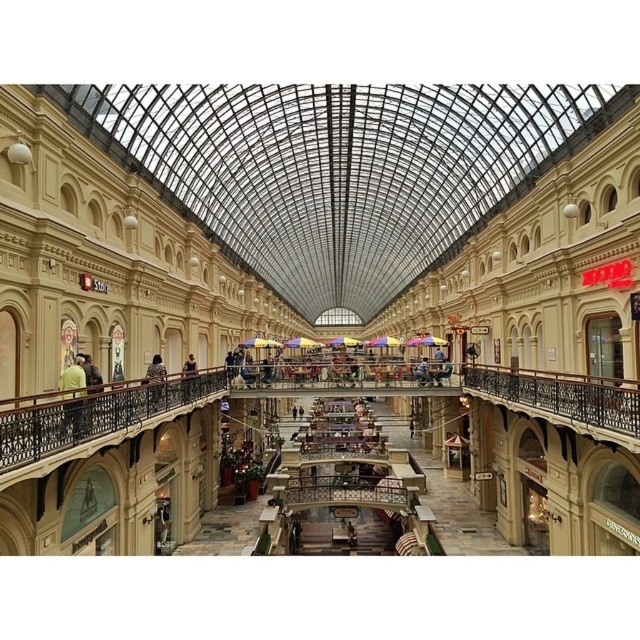
You are standing at the entrance of the grand shopping arcade and see a green fabric shirt at left. Where exactly is the green fabric shirt located in the scene?

The green fabric shirt at left is located at point [74,394] in the scene.

You are standing at the entrance of the grand shopping arcade and want to reach the beige stone mall at center. Based on the distance provided, can you estimate whether you can walk directly to it without needing to navigate around any obstacles?

The beige stone mall at center is 36.99 meters away from the camera. Given the vast distance and the description of the arcade being multi leveled with stalls and walkways, it is likely that you would need to navigate around obstacles such as lower level stalls or upper walkways to reach it directly.